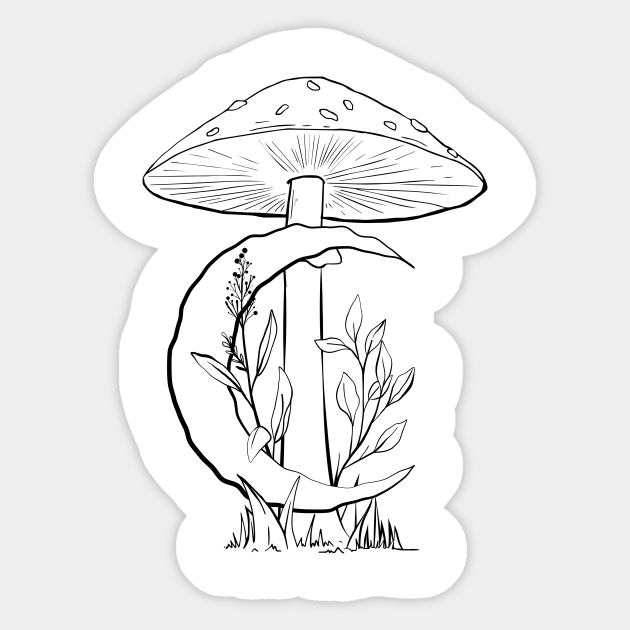
This screenshot has height=630, width=630. Find the location of `sticker`. sticker is located at coordinates (404, 344).